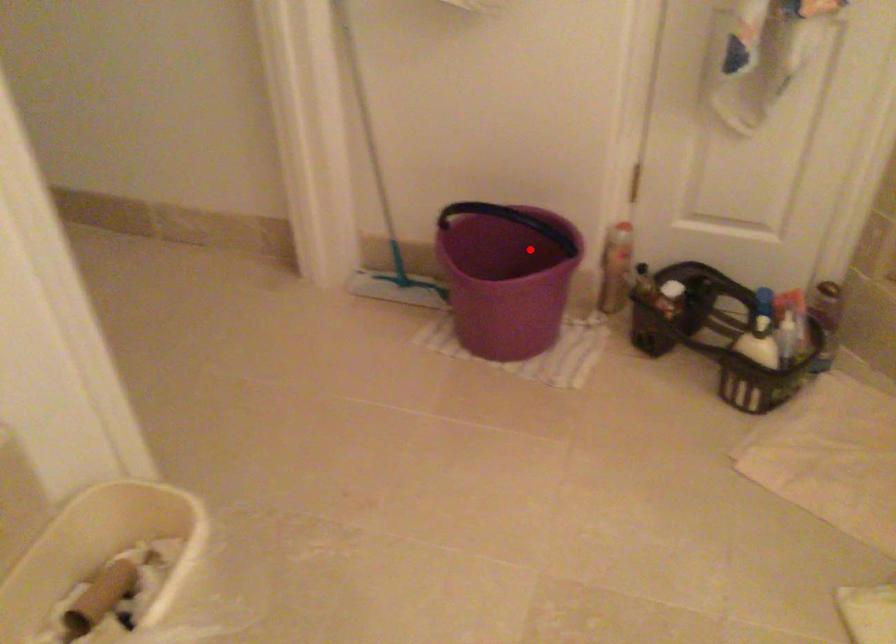
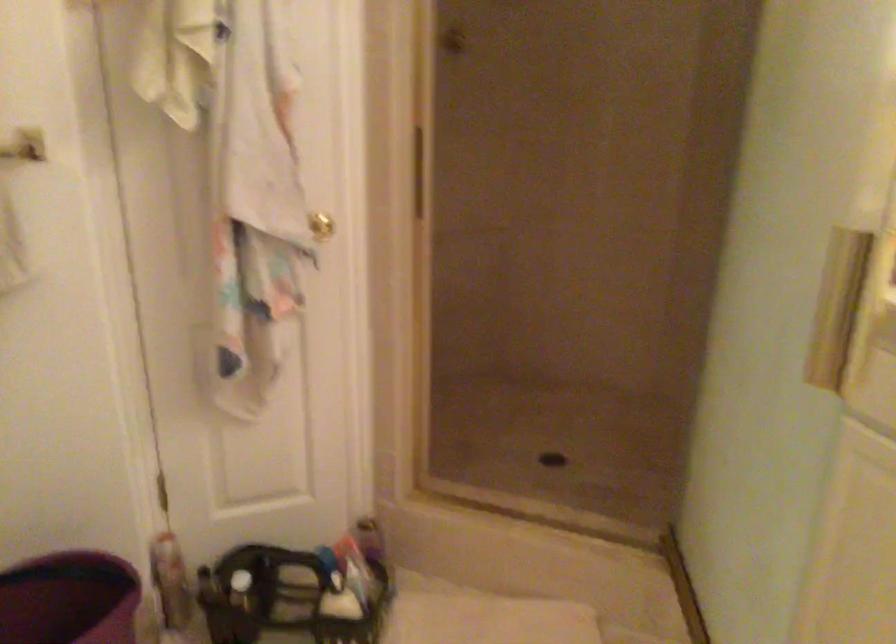
Find the pixel in the second image that matches the highlighted location in the first image.

(69, 599)